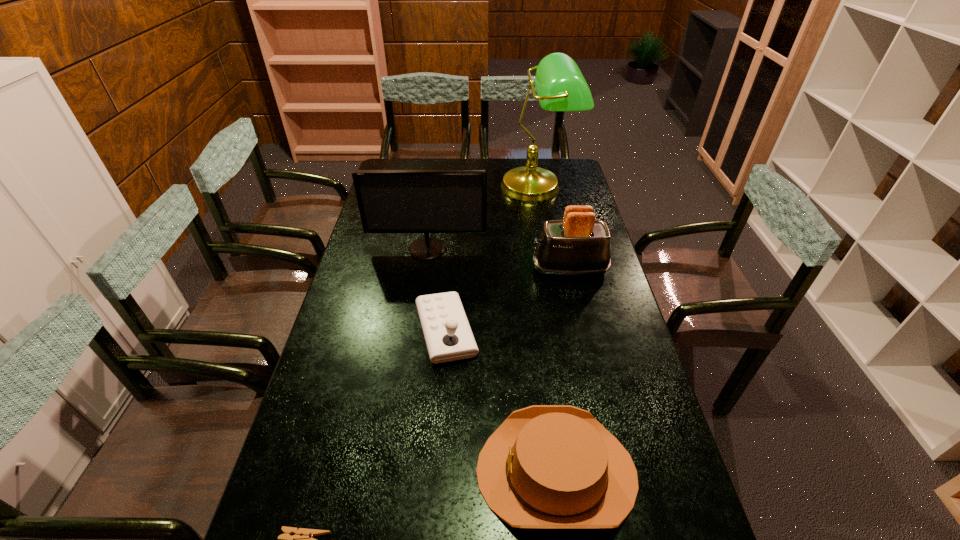
Where is `cowboy hat that is at the right edge`? The image size is (960, 540). cowboy hat that is at the right edge is located at coordinates (546, 466).

This screenshot has width=960, height=540. What are the coordinates of `object that is at the far right corner` in the screenshot? It's located at (560, 86).

This screenshot has width=960, height=540. What are the coordinates of `vacant region at the far edge of the desktop` in the screenshot? It's located at (460, 160).

At what (x,y) coordinates should I click in order to perform the action: click on vacant point at the left edge. Please return your answer as a coordinate pair (x, y). Looking at the image, I should click on (380, 262).

This screenshot has width=960, height=540. In order to click on free location at the right edge in this screenshot , I will do `click(643, 530)`.

I want to click on vacant region at the far right corner of the desktop, so click(x=558, y=180).

Find the location of a particular element. This screenshot has height=540, width=960. free space between the second tallest object and the fourth shortest object is located at coordinates (498, 259).

I want to click on free spot between the cowboy hat and the lamp, so click(547, 329).

Locate an element on the screen. Image resolution: width=960 pixels, height=540 pixels. vacant space that is in between the toaster and the cowboy hat is located at coordinates (564, 370).

Locate an element on the screen. vacant region between the computer monitor and the toaster is located at coordinates (498, 259).